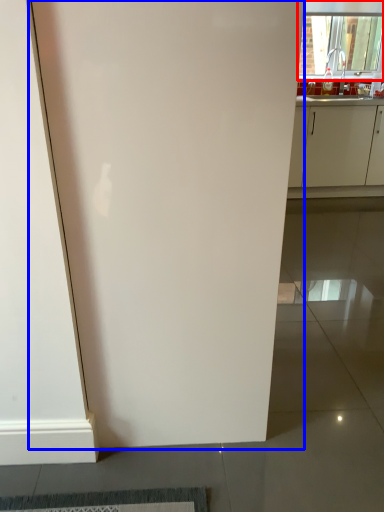
Question: Which object is further to the camera taking this photo, window (highlighted by a red box) or door (highlighted by a blue box)?

Choices:
 (A) window
 (B) door

Answer: (A)